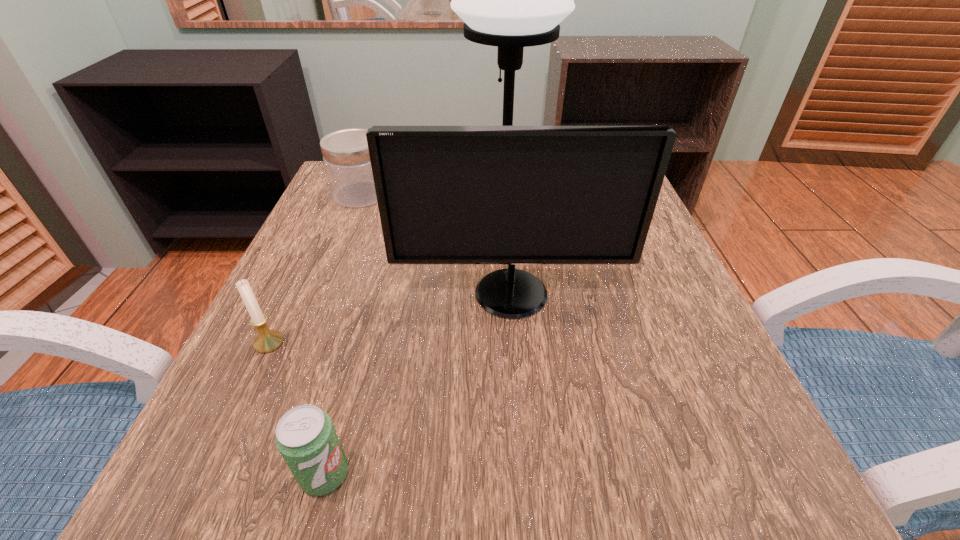
Locate an element on the screen. The image size is (960, 540). object present at the near left corner is located at coordinates coord(305,437).

I want to click on vacant space at the near edge of the desktop, so click(437, 451).

Identify the location of blank area at the left edge. Image resolution: width=960 pixels, height=540 pixels. (258, 402).

The height and width of the screenshot is (540, 960). In the image, there is a desktop. What are the coordinates of `free space at the right edge` in the screenshot? It's located at (623, 270).

Identify the location of free space at the near left corner of the desktop. The width and height of the screenshot is (960, 540). (284, 463).

Where is `blank region between the tallest object and the fourth farthest object`? blank region between the tallest object and the fourth farthest object is located at coordinates (387, 269).

Locate an element on the screen. The height and width of the screenshot is (540, 960). vacant space in between the third nearest object and the soda is located at coordinates (418, 384).

Where is `free spot between the nearest object and the jar`? The image size is (960, 540). free spot between the nearest object and the jar is located at coordinates (343, 334).

This screenshot has width=960, height=540. I want to click on free area in between the jar and the shortest object, so click(x=343, y=334).

Select which object is the closest to the shortest object. Please provide its 2D coordinates. Your answer should be formatted as a tuple, i.e. [(x, y)], where the tuple contains the x and y coordinates of a point satisfying the conditions above.

[(267, 340)]